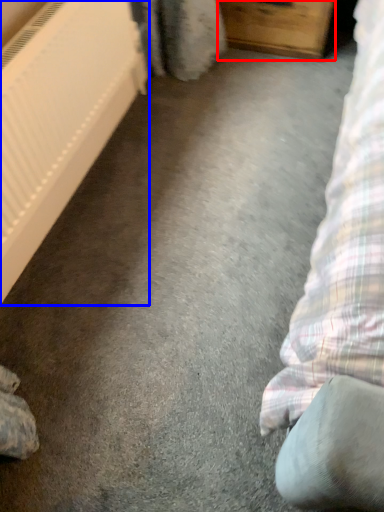
Question: Among these objects, which one is farthest to the camera, furniture (highlighted by a red box) or radiator (highlighted by a blue box)?

Choices:
 (A) furniture
 (B) radiator

Answer: (A)